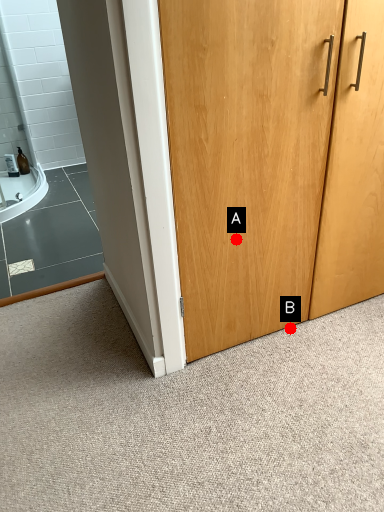
Question: Two points are circled on the image, labeled by A and B beside each circle. Which point is farther to the camera?

Choices:
 (A) A is further
 (B) B is further

Answer: (B)